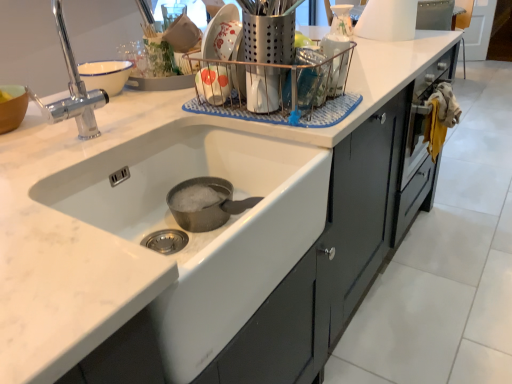
Question: From the image's perspective, is satin silver utensil holder at upper center, acting as the first appliance starting from the left, below clear plastic container at upper center, the third appliance viewed from the right?

Choices:
 (A) yes
 (B) no

Answer: (B)

Question: From a real-world perspective, is satin silver utensil holder at upper center, which appears as the fourth appliance when viewed from the back, physically below clear plastic container at upper center, the third appliance viewed from the right?

Choices:
 (A) yes
 (B) no

Answer: (B)

Question: Is the depth of satin silver utensil holder at upper center, which appears as the fourth appliance when viewed from the back, less than that of clear plastic container at upper center, marked as the 2th appliance in a front-to-back arrangement?

Choices:
 (A) yes
 (B) no

Answer: (A)

Question: Can you confirm if satin silver utensil holder at upper center, which appears as the 4th appliance when viewed from the right, is smaller than clear plastic container at upper center, the second appliance in the left-to-right sequence?

Choices:
 (A) yes
 (B) no

Answer: (B)

Question: Would you say satin silver utensil holder at upper center, which appears as the fourth appliance when viewed from the back, is a long distance from clear plastic container at upper center, the third appliance viewed from the right?

Choices:
 (A) yes
 (B) no

Answer: (B)

Question: Considering the relative sizes of satin silver utensil holder at upper center, acting as the first appliance starting from the left, and clear plastic container at upper center, the second appliance in the left-to-right sequence, in the image provided, is satin silver utensil holder at upper center, acting as the first appliance starting from the left, taller than clear plastic container at upper center, the second appliance in the left-to-right sequence,?

Choices:
 (A) yes
 (B) no

Answer: (B)

Question: Considering the relative sizes of white glossy coffee pot at upper center, the first appliance when ordered from back to front, and white glossy sink at center in the image provided, is white glossy coffee pot at upper center, the first appliance when ordered from back to front, thinner than white glossy sink at center?

Choices:
 (A) no
 (B) yes

Answer: (B)

Question: Is white glossy coffee pot at upper center, the second appliance in the right-to-left sequence, touching white glossy sink at center?

Choices:
 (A) no
 (B) yes

Answer: (A)

Question: Is white glossy coffee pot at upper center, acting as the third appliance starting from the left, positioned behind white glossy sink at center?

Choices:
 (A) yes
 (B) no

Answer: (A)

Question: Is white glossy coffee pot at upper center, acting as the third appliance starting from the left, looking in the opposite direction of white glossy sink at center?

Choices:
 (A) no
 (B) yes

Answer: (A)

Question: Would you say white glossy sink at center is part of white glossy coffee pot at upper center, acting as the third appliance starting from the left,'s contents?

Choices:
 (A) yes
 (B) no

Answer: (B)

Question: Considering the relative positions of white glossy coffee pot at upper center, which is the fourth appliance in front-to-back order, and white glossy sink at center in the image provided, is white glossy coffee pot at upper center, which is the fourth appliance in front-to-back order, to the right of white glossy sink at center from the viewer's perspective?

Choices:
 (A) yes
 (B) no

Answer: (A)

Question: Does white glossy sink at center appear on the right side of clear plastic container at upper center, the third appliance viewed from the right?

Choices:
 (A) no
 (B) yes

Answer: (A)